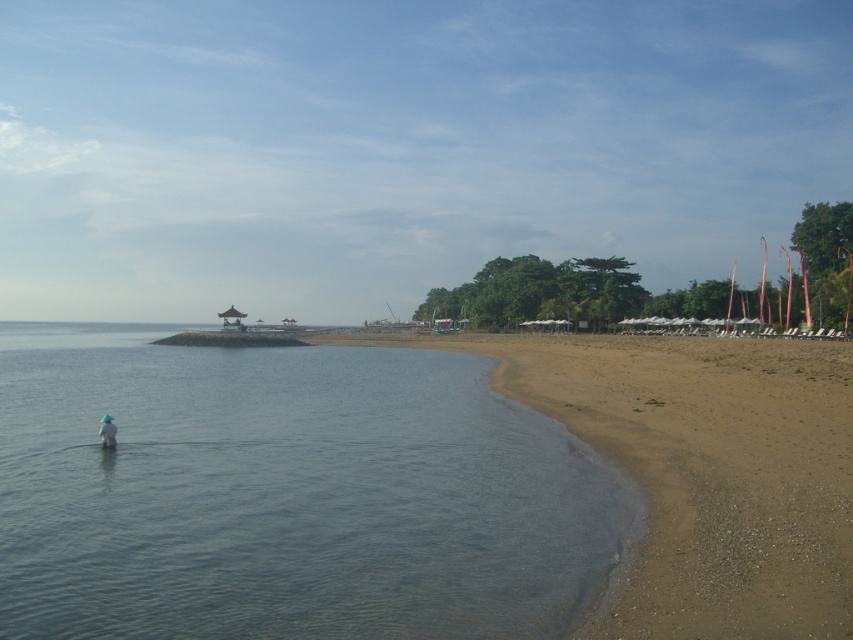
Can you confirm if clear water at lower left is positioned to the left of sandy beach at lower right?

Correct, you'll find clear water at lower left to the left of sandy beach at lower right.

Between clear water at lower left and sandy beach at lower right, which one appears on the right side from the viewer's perspective?

Positioned to the right is sandy beach at lower right.

You are a GUI agent. You are given a task and a screenshot of the screen. Output one action in this format:
    pyautogui.click(x=<x>, y=<y>)
    Task: Click on the clear water at lower left
    The height and width of the screenshot is (640, 853).
    Given the screenshot: What is the action you would take?
    pyautogui.click(x=286, y=493)

Find the location of a particular element. The image size is (853, 640). clear water at lower left is located at coordinates (286, 493).

Which is in front, point (426, 497) or point (114, 445)?

Positioned in front is point (426, 497).

Is point (312, 422) positioned after point (107, 416)?

Yes, point (312, 422) is farther from viewer.

Image resolution: width=853 pixels, height=640 pixels. What are the coordinates of `clear water at lower left` in the screenshot? It's located at (286, 493).

Is the position of sandy beach at lower right more distant than that of white fabric hat at lower left?

No, sandy beach at lower right is closer to the viewer.

Is sandy beach at lower right shorter than white fabric hat at lower left?

No, sandy beach at lower right is not shorter than white fabric hat at lower left.

Who is more distant from viewer, (x=619, y=454) or (x=113, y=440)?

Positioned behind is point (x=113, y=440).

Image resolution: width=853 pixels, height=640 pixels. Identify the location of sandy beach at lower right. (701, 470).